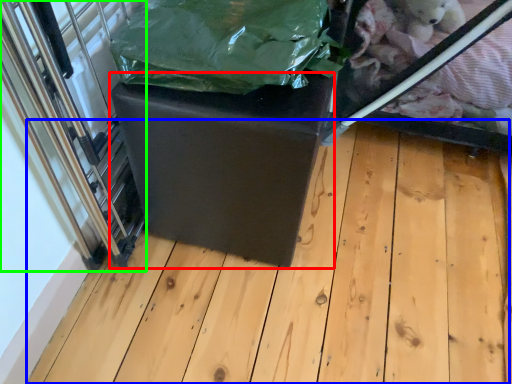
Question: Which object is positioned farthest from table (highlighted by a red box)? Select from wood (highlighted by a blue box) and glass door (highlighted by a green box).

Choices:
 (A) wood
 (B) glass door

Answer: (A)